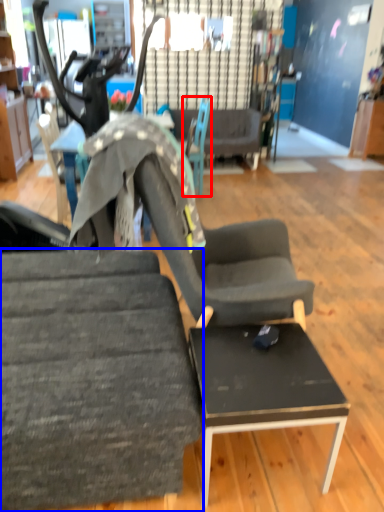
Question: Which of the following is the closest to the observer, chair (highlighted by a red box) or chair (highlighted by a blue box)?

Choices:
 (A) chair
 (B) chair

Answer: (B)